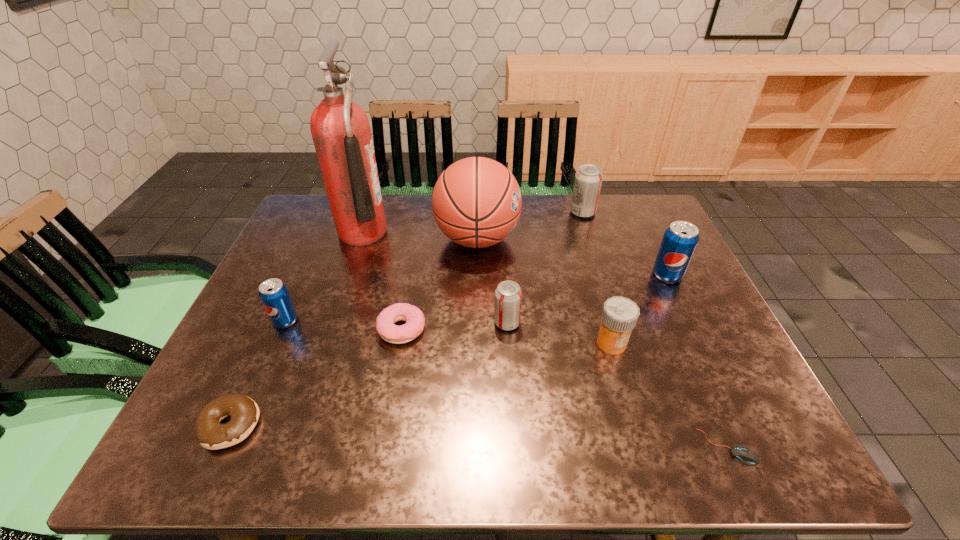
Image resolution: width=960 pixels, height=540 pixels. What are the coordinates of `object located at the near left corner` in the screenshot? It's located at (244, 412).

Where is `object that is at the near right corner`? This screenshot has width=960, height=540. object that is at the near right corner is located at coordinates coord(746,455).

The image size is (960, 540). Find the location of `vacant area at the far edge of the desktop`. vacant area at the far edge of the desktop is located at coordinates (430, 233).

This screenshot has width=960, height=540. In the image, there is a desktop. Find the location of `free space at the near edge`. free space at the near edge is located at coordinates (484, 434).

I want to click on free spot at the left edge of the desktop, so click(269, 383).

In the image, there is a desktop. Where is `vacant space at the right edge`? vacant space at the right edge is located at coordinates (644, 241).

The height and width of the screenshot is (540, 960). Identify the location of vacant space at the far right corner of the desktop. (633, 238).

Locate an element on the screen. free space that is in between the mouse and the brown doughnut is located at coordinates (479, 436).

I want to click on empty location between the mouse and the orange medicine, so [x=669, y=395].

Where is `unoccupied position between the farther doughnut and the left doughnut`? This screenshot has width=960, height=540. unoccupied position between the farther doughnut and the left doughnut is located at coordinates (316, 377).